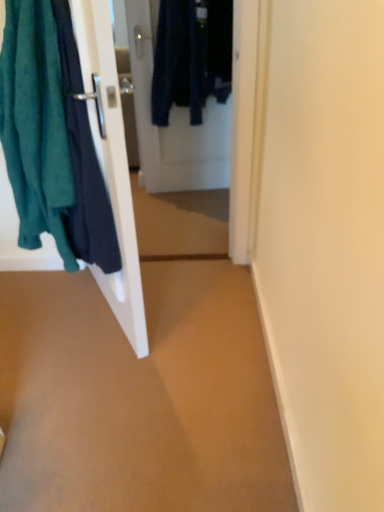
Question: From the image's perspective, is teal fabric towel at left located above or below brown matte carpet at center?

Choices:
 (A) below
 (B) above

Answer: (B)

Question: Considering the positions of teal fabric towel at left and brown matte carpet at center in the image, is teal fabric towel at left taller or shorter than brown matte carpet at center?

Choices:
 (A) short
 (B) tall

Answer: (B)

Question: Considering the real-world distances, which object is farthest from the white glossy door at left, the 1th door in the front-to-back sequence?

Choices:
 (A) brown matte carpet at center
 (B) white glossy door at center, positioned as the second door in front-to-back order
 (C) teal fabric towel at left

Answer: (B)

Question: Which object is the closest to the white glossy door at left, positioned as the second door in back-to-front order?

Choices:
 (A) white glossy door at center, positioned as the second door in front-to-back order
 (B) teal fabric towel at left
 (C) brown matte carpet at center

Answer: (B)